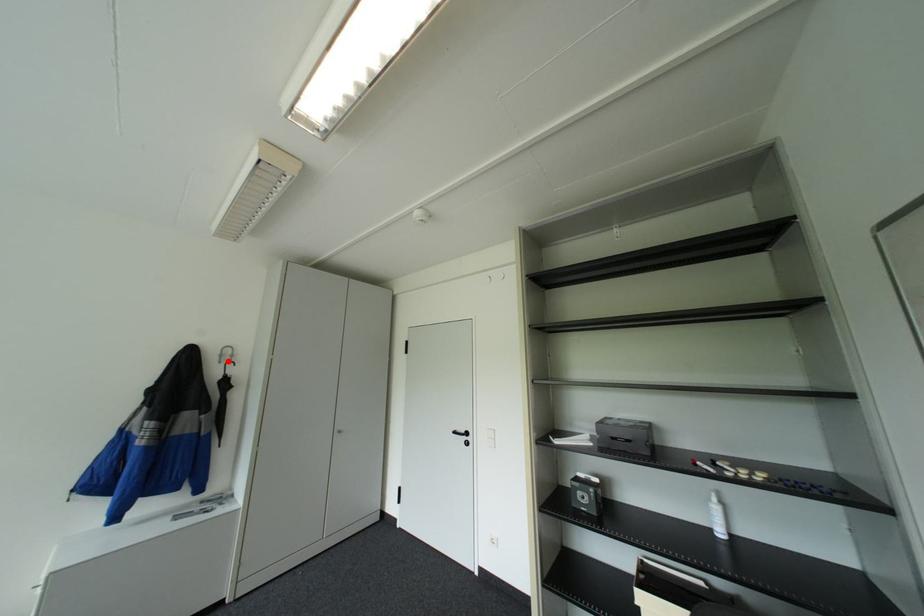
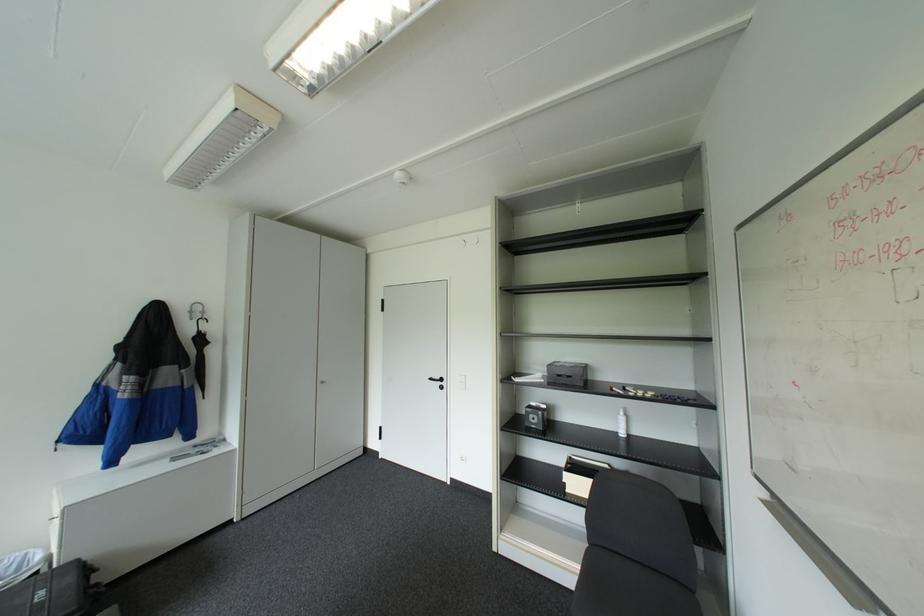
The point at the highlighted location is marked in the first image. Where is the corresponding point in the second image?

(200, 318)